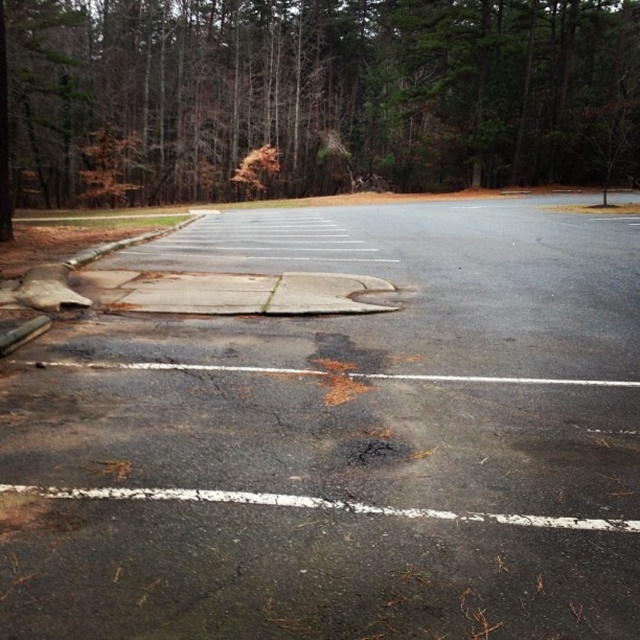
Question: Does black asphalt parking lot at center have a smaller size compared to cracked asphalt at center?

Choices:
 (A) no
 (B) yes

Answer: (A)

Question: Can you confirm if brown textured tree at upper center is positioned above gray concrete curb at left?

Choices:
 (A) no
 (B) yes

Answer: (B)

Question: Is black asphalt parking lot at center to the right of cracked asphalt at center from the viewer's perspective?

Choices:
 (A) yes
 (B) no

Answer: (A)

Question: Which point appears closest to the camera in this image?

Choices:
 (A) (198, 472)
 (B) (262, 307)
 (C) (74, 259)
 (D) (486, 84)

Answer: (A)

Question: Among these objects, which one is farthest from the camera?

Choices:
 (A) black asphalt parking lot at center
 (B) gray concrete curb at left

Answer: (B)

Question: Among these points, which one is farthest from the camera?

Choices:
 (A) (106, 243)
 (B) (273, 285)
 (C) (250, 3)

Answer: (C)